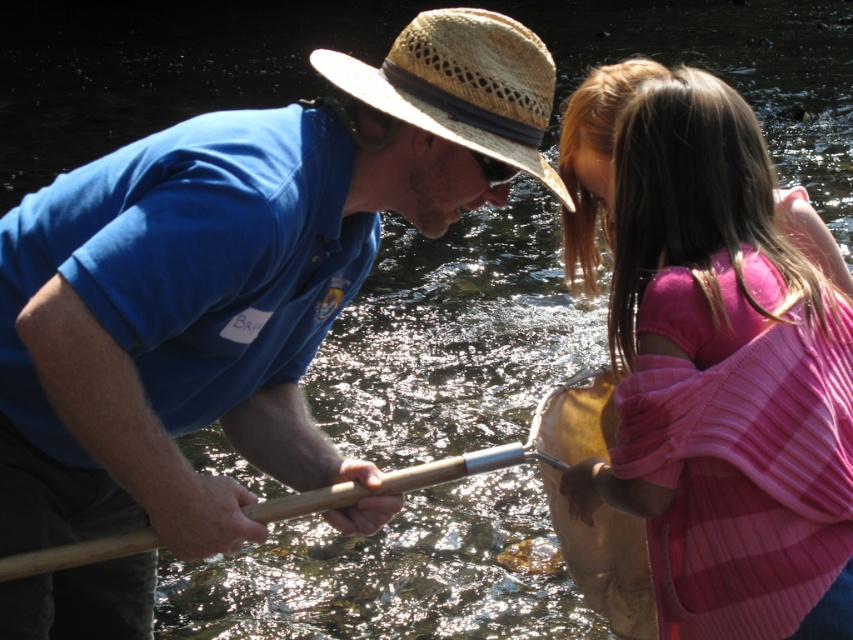
Question: Which point is closer to the camera taking this photo?

Choices:
 (A) (402, 92)
 (B) (532, 456)

Answer: (A)

Question: Does straw hat at center appear over wooden paddle at center?

Choices:
 (A) no
 (B) yes

Answer: (B)

Question: Does straw hat at center appear over wooden paddle at center?

Choices:
 (A) yes
 (B) no

Answer: (A)

Question: Is matte blue shirt at center wider than straw hat at center?

Choices:
 (A) no
 (B) yes

Answer: (B)

Question: Estimate the real-world distances between objects in this image. Which object is closer to the straw hat at center?

Choices:
 (A) matte blue shirt at center
 (B) pink ribbed sweater at upper right
 (C) wooden paddle at center

Answer: (B)

Question: Which object is the farthest from the wooden paddle at center?

Choices:
 (A) straw hat at center
 (B) pink ribbed sweater at upper right
 (C) matte blue shirt at center

Answer: (A)